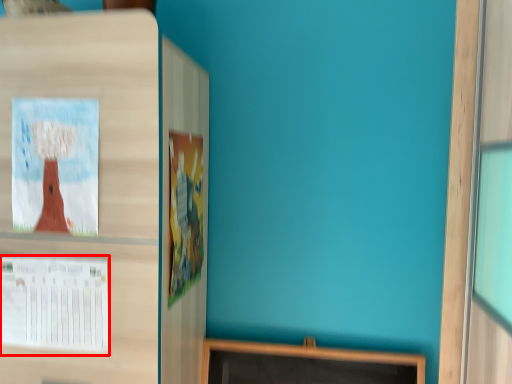
Question: From the image's perspective, where is poster (annotated by the red box) located relative to poster?

Choices:
 (A) above
 (B) below

Answer: (B)